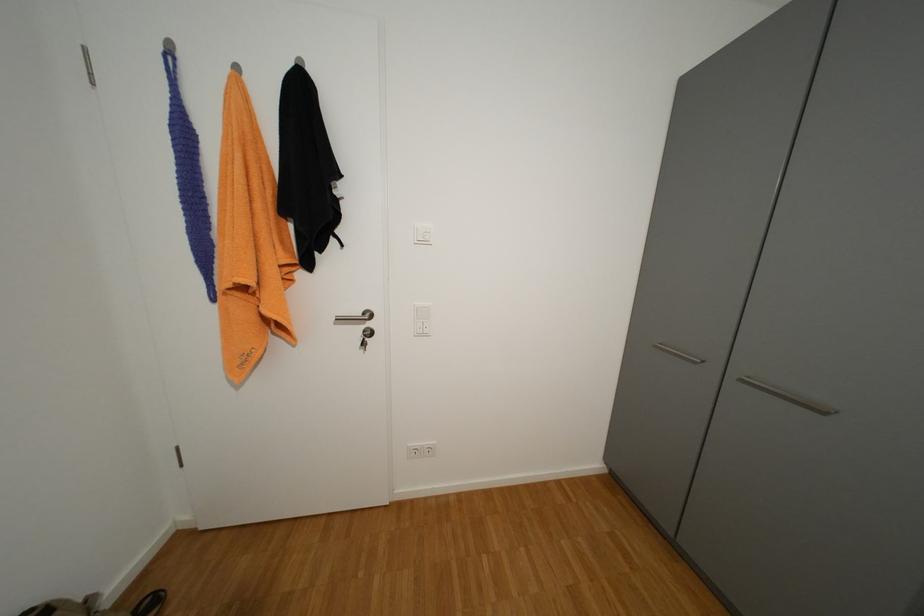
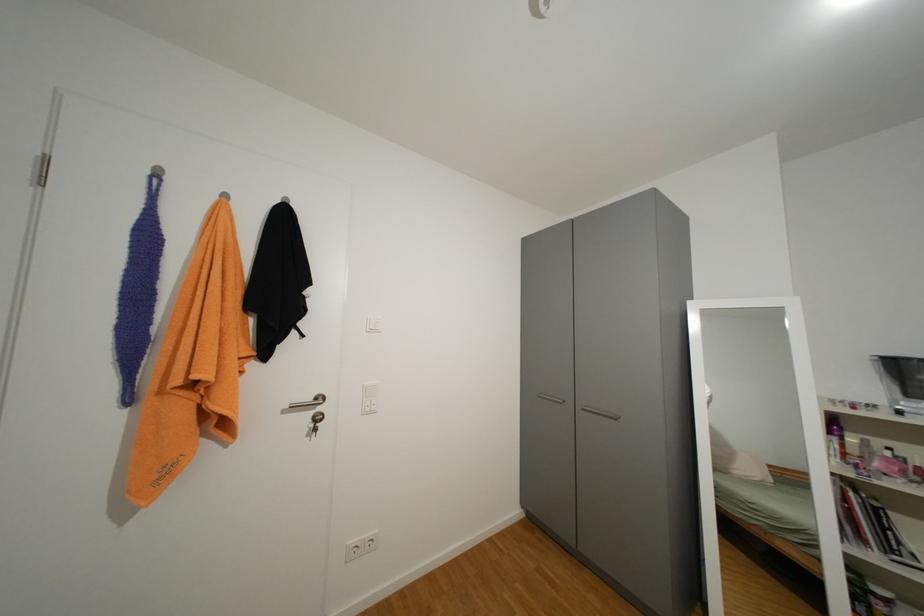
Which direction would the cameraman need to move to produce the second image?

The movement direction of the cameraman is left, backward.